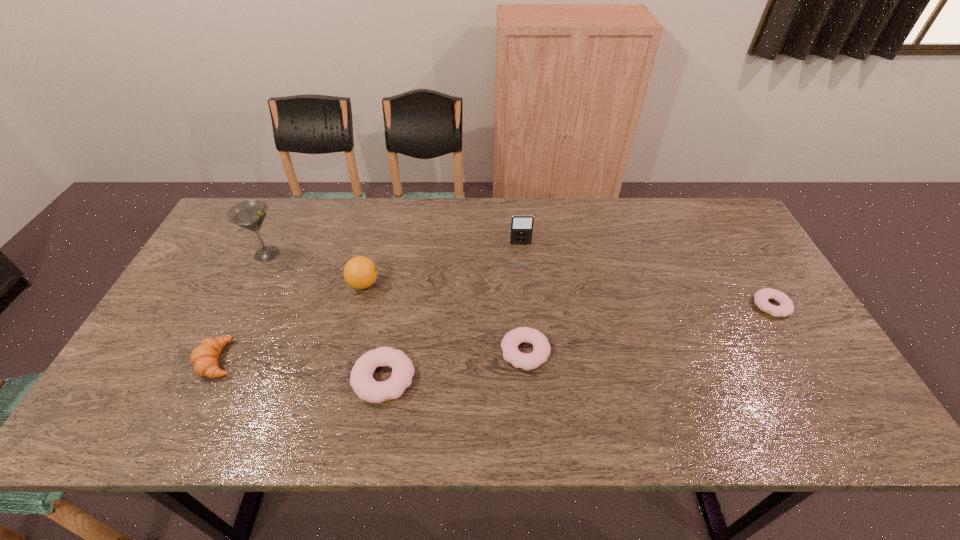
This screenshot has width=960, height=540. Identify the location of the sixth closest object to the tallest doughnut. (786, 307).

Select which doughnut appears as the closest to the crescent roll. Please provide its 2D coordinates. Your answer should be formatted as a tuple, i.e. [(x, y)], where the tuple contains the x and y coordinates of a point satisfying the conditions above.

[(361, 378)]

Locate which doughnut is the closest to the tallest doughnut. Please provide its 2D coordinates. Your answer should be formatted as a tuple, i.e. [(x, y)], where the tuple contains the x and y coordinates of a point satisfying the conditions above.

[(541, 348)]

I want to click on vacant region that satisfies the following two spatial constraints: 1. on the back side of the shortest object; 2. on the side with brand of the ping-pong ball, so (758, 284).

Find the location of a particular element. Image resolution: width=960 pixels, height=540 pixels. blank space that satisfies the following two spatial constraints: 1. on the side with brand of the leftmost doughnut; 2. on the right side of the ping-pong ball is located at coordinates (340, 379).

The width and height of the screenshot is (960, 540). What are the coordinates of `vacant space that satisfies the following two spatial constraints: 1. on the back side of the second doughnut from left to right; 2. on the left side of the tallest doughnut` in the screenshot? It's located at (389, 352).

Identify the location of vacant space that satisfies the following two spatial constraints: 1. on the front-facing side of the sixth shortest object; 2. on the side with brand of the ping-pong ball. (524, 284).

At what (x,y) coordinates should I click in order to perform the action: click on vacant space that satisfies the following two spatial constraints: 1. on the side with brand of the third tallest object; 2. on the back side of the second tallest doughnut. Please return your answer as a coordinate pair (x, y). Looking at the image, I should click on (347, 352).

Where is `free spot that satisfies the following two spatial constraints: 1. on the front-facing side of the sixth shortest object; 2. on the left side of the shortest object`? free spot that satisfies the following two spatial constraints: 1. on the front-facing side of the sixth shortest object; 2. on the left side of the shortest object is located at coordinates (526, 306).